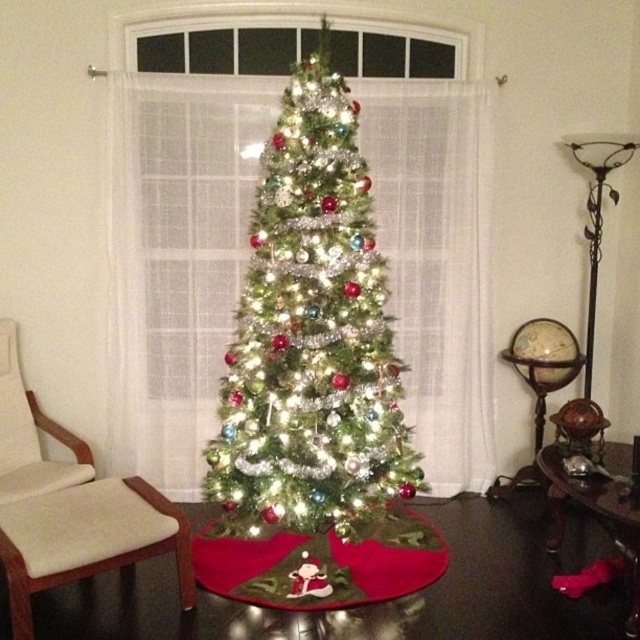
Is iridescent shiny tree at center positioned behind light brown wooden stool at lower left?

Yes, iridescent shiny tree at center is behind light brown wooden stool at lower left.

Who is positioned more to the right, iridescent shiny tree at center or light brown wooden stool at lower left?

iridescent shiny tree at center is more to the right.

What do you see at coordinates (310, 333) in the screenshot? I see `iridescent shiny tree at center` at bounding box center [310, 333].

Identify the location of iridescent shiny tree at center. Image resolution: width=640 pixels, height=640 pixels. (310, 333).